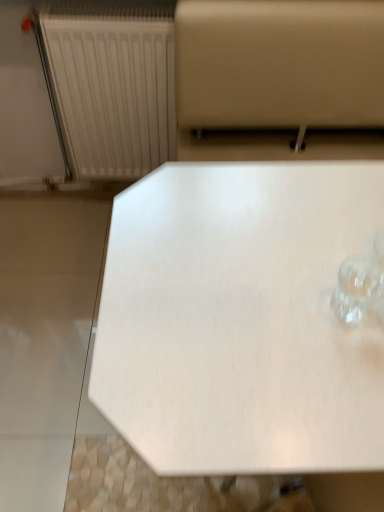
Describe the element at coordinates (240, 320) in the screenshot. I see `white matte table at center` at that location.

Locate an element on the screen. The image size is (384, 512). white matte table at center is located at coordinates (240, 320).

The height and width of the screenshot is (512, 384). I want to click on white matte table at center, so click(240, 320).